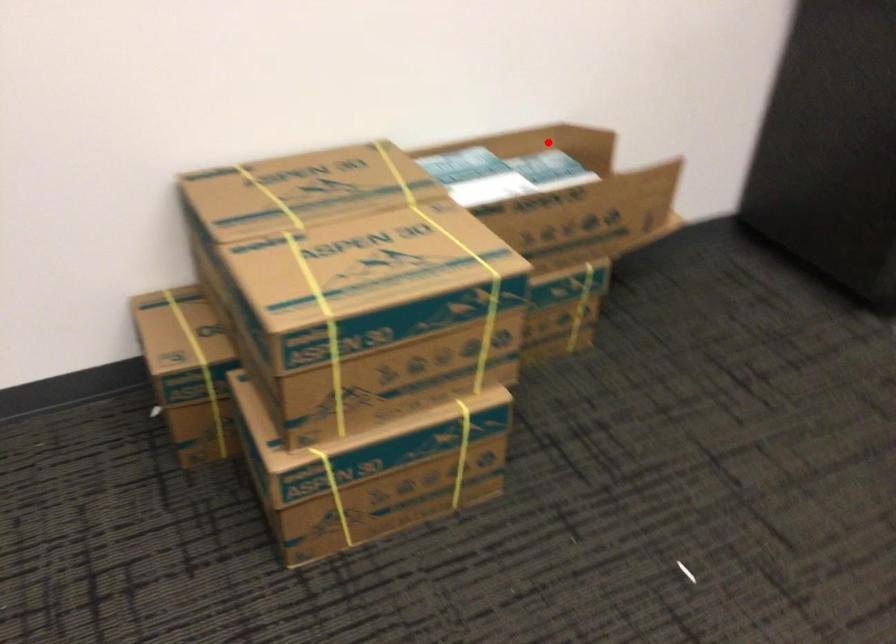
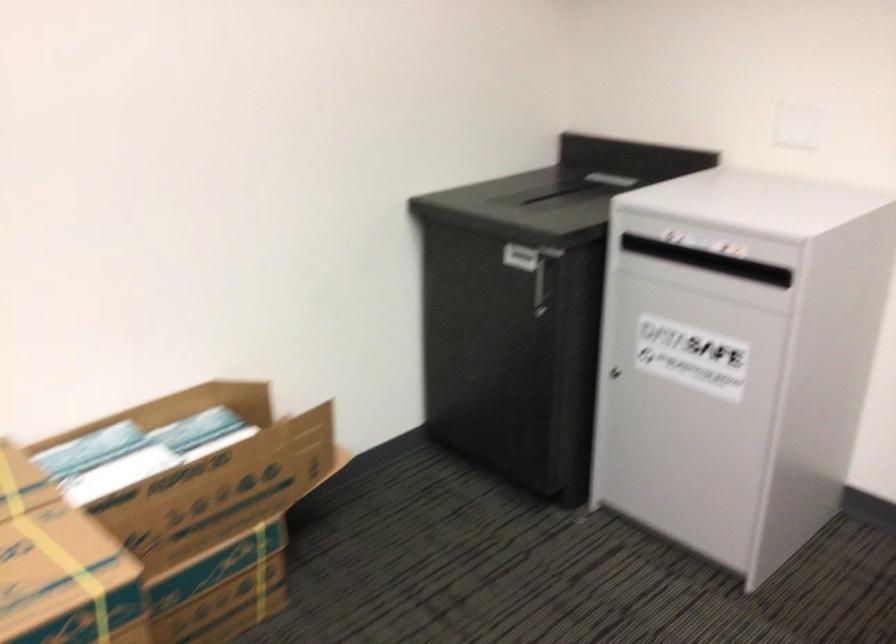
Locate, in the second image, the point that corresponds to the highlighted location in the first image.

(211, 402)